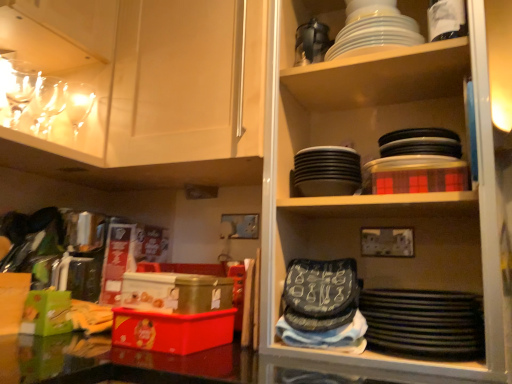
Question: Is white glossy plates at upper center, the 1th tableware positioned from the right, touching black matte platter at lower right?

Choices:
 (A) yes
 (B) no

Answer: (B)

Question: Is white glossy plates at upper center, the 1th tableware positioned from the right, shorter than black matte platter at lower right?

Choices:
 (A) no
 (B) yes

Answer: (B)

Question: Would you consider white glossy plates at upper center, positioned as the 4th tableware in left-to-right order, to be distant from black matte platter at lower right?

Choices:
 (A) yes
 (B) no

Answer: (B)

Question: Can you confirm if white glossy plates at upper center, the 1th tableware positioned from the right, is thinner than black matte platter at lower right?

Choices:
 (A) no
 (B) yes

Answer: (B)

Question: Does white glossy plates at upper center, positioned as the 4th tableware in left-to-right order, have a smaller size compared to black matte platter at lower right?

Choices:
 (A) yes
 (B) no

Answer: (A)

Question: Is the position of white glossy plates at upper center, the 1th tableware positioned from the right, less distant than that of black matte platter at lower right?

Choices:
 (A) yes
 (B) no

Answer: (B)

Question: Are black matte platter at lower right and black matte plates at upper center, positioned as the 2th tableware in right-to-left order, located far from each other?

Choices:
 (A) no
 (B) yes

Answer: (A)

Question: Does black matte platter at lower right have a lesser width compared to black matte plates at upper center, the third tableware viewed from the left?

Choices:
 (A) no
 (B) yes

Answer: (A)

Question: From the image's perspective, does black matte platter at lower right appear lower than black matte plates at upper center, the third tableware viewed from the left?

Choices:
 (A) no
 (B) yes

Answer: (B)

Question: From the image's perspective, is black matte platter at lower right located above black matte plates at upper center, the third tableware viewed from the left?

Choices:
 (A) no
 (B) yes

Answer: (A)

Question: Is black matte platter at lower right positioned with its back to black matte plates at upper center, the third tableware viewed from the left?

Choices:
 (A) yes
 (B) no

Answer: (B)

Question: Is black matte platter at lower right located outside black matte plates at upper center, the third tableware viewed from the left?

Choices:
 (A) yes
 (B) no

Answer: (A)

Question: Considering the relative sizes of clear glass wine glasses at upper left, acting as the third tableware starting from the right, and matte white cabinet at upper left in the image provided, is clear glass wine glasses at upper left, acting as the third tableware starting from the right, wider than matte white cabinet at upper left?

Choices:
 (A) no
 (B) yes

Answer: (A)